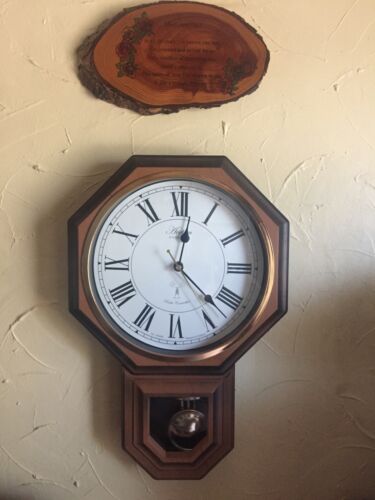
Locate an element on the screen. The width and height of the screenshot is (375, 500). wood (decorative) is located at coordinates (164, 41).